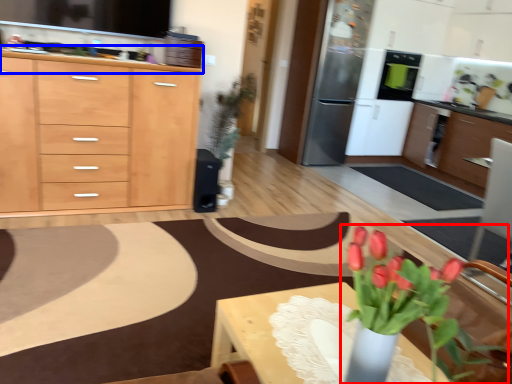
Question: Which object appears farthest to the camera in this image, houseplant (highlighted by a red box) or countertop (highlighted by a blue box)?

Choices:
 (A) houseplant
 (B) countertop

Answer: (B)